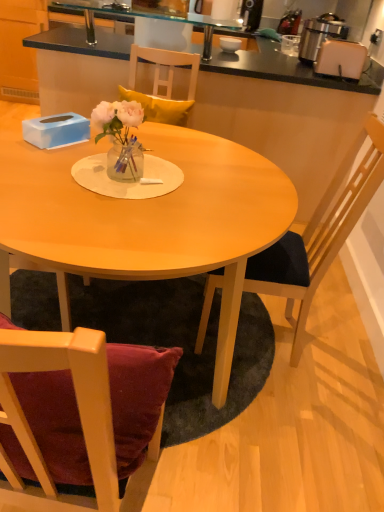
The image size is (384, 512). I want to click on vacant space in front of wooden chair at right, so click(x=319, y=418).